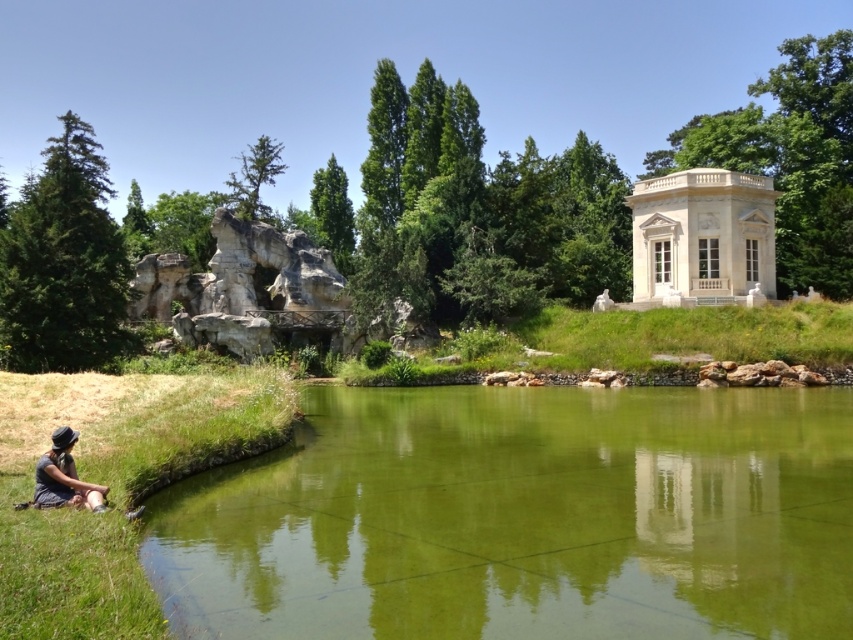
Which is behind, point (689, 257) or point (70, 435)?

Positioned behind is point (689, 257).

Is point (706, 253) more distant than point (61, 493)?

Yes.

I want to click on white marble pavilion at upper right, so click(x=703, y=237).

Which is above, green smooth water at center or white marble pavilion at upper right?

Positioned higher is white marble pavilion at upper right.

Locate an element on the screen. green smooth water at center is located at coordinates (521, 518).

Which is more to the right, green smooth water at center or matte black hat at lower left?

green smooth water at center

Between green smooth water at center and matte black hat at lower left, which one appears on the left side from the viewer's perspective?

matte black hat at lower left

This screenshot has width=853, height=640. Describe the element at coordinates (521, 518) in the screenshot. I see `green smooth water at center` at that location.

I want to click on green smooth water at center, so click(521, 518).